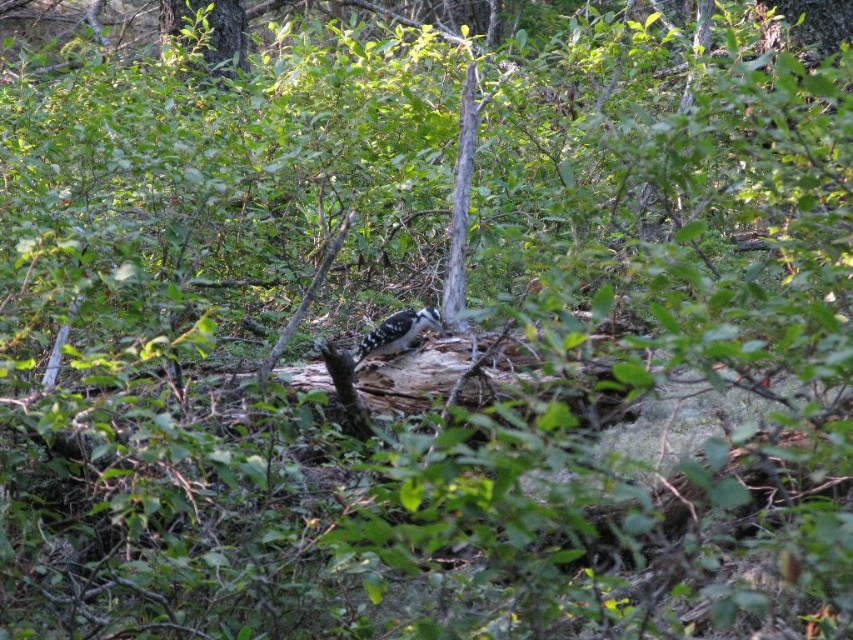
Find the location of a particular element. The image size is (853, 640). green leafy tree at upper center is located at coordinates (210, 29).

Which is more to the left, green leafy tree at upper center or speckled brown woodpecker at center?

green leafy tree at upper center

Is point (167, 1) behind point (436, 314)?

Yes, point (167, 1) is farther from viewer.

Identify the location of green leafy tree at upper center. (210, 29).